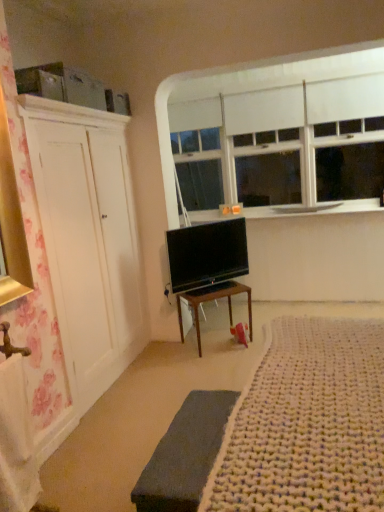
Locate an element on the screen. This screenshot has width=384, height=512. flat screen tv at center is located at coordinates (207, 254).

This screenshot has height=512, width=384. What do you see at coordinates (207, 254) in the screenshot? I see `flat screen tv at center` at bounding box center [207, 254].

At what (x,y) coordinates should I click in order to perform the action: click on white matte window at upper center. Please return your answer as a coordinate pair (x, y). Looking at the image, I should click on (283, 120).

The image size is (384, 512). Describe the element at coordinates (283, 120) in the screenshot. I see `white matte window at upper center` at that location.

This screenshot has width=384, height=512. I want to click on dark gray fabric bed frame at lower center, so click(x=185, y=454).

From a real-world perspective, which object rests below the other?

In real-world perspective, dark gray fabric bed frame at lower center is lower.

Is point (190, 429) farther from viewer compared to point (178, 295)?

No, it is not.

Which object is thinner, dark gray fabric bed frame at lower center or wooden desk at center?

With smaller width is dark gray fabric bed frame at lower center.

Is dark gray fabric bed frame at lower center taller or shorter than wooden desk at center?

Clearly, dark gray fabric bed frame at lower center is shorter compared to wooden desk at center.

Locate an element on the screen. Image resolution: width=384 pixels, height=512 pixels. plain on the right of dark gray fabric bed frame at lower center is located at coordinates (306, 423).

Which is closer, (139, 495) or (366, 485)?

Point (139, 495) appears to be farther away from the viewer than point (366, 485).

Considering the sizes of objects dark gray fabric bed frame at lower center and white knitted rug at lower right in the image provided, who is wider, dark gray fabric bed frame at lower center or white knitted rug at lower right?

With larger width is white knitted rug at lower right.

Does point (166, 175) lie behind point (336, 504)?

Yes, point (166, 175) is farther from viewer.

In the scene shown: Based on their positions, is white matte window at upper center located to the left or right of white knitted rug at lower right?

white matte window at upper center is to the right of white knitted rug at lower right.

Is there a large distance between white matte window at upper center and white knitted rug at lower right?

Yes, white matte window at upper center and white knitted rug at lower right are quite far apart.

Can you confirm if white matte window at upper center is bigger than white knitted rug at lower right?

Correct, white matte window at upper center is larger in size than white knitted rug at lower right.

Relative to white smooth window sill at upper center, is flat screen tv at center in front or behind?

In the image, flat screen tv at center appears in front of white smooth window sill at upper center.

From the image's perspective, which one is positioned lower, flat screen tv at center or white smooth window sill at upper center?

From the image's view, flat screen tv at center is below.

What's the angular difference between flat screen tv at center and white smooth window sill at upper center's facing directions?

There is a 47-degree angle between the facing directions of flat screen tv at center and white smooth window sill at upper center.

Considering the positions of point (178, 248) and point (321, 206), is point (178, 248) closer or farther from the camera than point (321, 206)?

Clearly, point (178, 248) is closer to the camera than point (321, 206).

Is flat screen tv at center surrounded by white matte window at upper center?

No, flat screen tv at center is not inside white matte window at upper center.

How far apart are white matte window at upper center and flat screen tv at center?

They are 4.08 feet apart.

What are the coordinates of `window that appears behind the flat screen tv at center` in the screenshot? It's located at (283, 120).

Based on their positions, is white matte window at upper center located to the left or right of flat screen tv at center?

white matte window at upper center is to the right of flat screen tv at center.

Which of these two, flat screen tv at center or white matte window at upper center, is smaller?

flat screen tv at center is smaller.

From a real-world perspective, is flat screen tv at center on white matte window at upper center?

Actually, flat screen tv at center is physically below white matte window at upper center in the real world.

Does flat screen tv at center come behind white matte window at upper center?

No, it is in front of white matte window at upper center.

I want to click on bed frame that is in front of the white matte window at upper center, so click(x=185, y=454).

Can you confirm if dark gray fabric bed frame at lower center is bigger than white matte window at upper center?

No, dark gray fabric bed frame at lower center is not bigger than white matte window at upper center.

From the image's perspective, which object appears higher, dark gray fabric bed frame at lower center or white matte window at upper center?

white matte window at upper center, from the image's perspective.

Which of these two, dark gray fabric bed frame at lower center or white matte window at upper center, is wider?

dark gray fabric bed frame at lower center is wider.

Locate an element on the screen. The image size is (384, 512). bed frame directly beneath the wooden desk at center (from a real-world perspective) is located at coordinates click(x=185, y=454).

Locate an element on the screen. Image resolution: width=384 pixels, height=512 pixels. bed frame behind the white knitted rug at lower right is located at coordinates (185, 454).

Estimate the real-world distances between objects in this image. Which object is closer to white smooth window sill at upper center, wooden desk at center or white matte window at upper center?

white matte window at upper center.

From the image, which object appears to be nearer to flat screen tv at center, white smooth window sill at upper center or white matte window at upper center?

white smooth window sill at upper center lies closer to flat screen tv at center than the other object.

Which object lies further to the anchor point white knitted rug at lower right, white matte window at upper center or dark gray fabric bed frame at lower center?

white matte window at upper center is positioned further to the anchor white knitted rug at lower right.

In the scene shown: Estimate the real-world distances between objects in this image. Which object is closer to wooden desk at center, white knitted rug at lower right or white smooth window sill at upper center?

The object closer to wooden desk at center is white smooth window sill at upper center.

From the image, which object appears to be farther from white smooth window sill at upper center, white matte window at upper center or white knitted rug at lower right?

The object further to white smooth window sill at upper center is white knitted rug at lower right.

When comparing their distances from white matte window at upper center, does dark gray fabric bed frame at lower center or white smooth window sill at upper center seem further?

dark gray fabric bed frame at lower center is positioned further to the anchor white matte window at upper center.

Looking at the image, which one is located further to white smooth window sill at upper center, flat screen tv at center or wooden desk at center?

The object further to white smooth window sill at upper center is wooden desk at center.

Looking at the image, which one is located further to dark gray fabric bed frame at lower center, wooden desk at center or flat screen tv at center?

flat screen tv at center is positioned further to the anchor dark gray fabric bed frame at lower center.

Locate an element on the screen. The width and height of the screenshot is (384, 512). television between white matte window at upper center and wooden desk at center in the vertical direction is located at coordinates (207, 254).

This screenshot has height=512, width=384. Find the location of `bed frame between white knitted rug at lower right and wooden desk at center from front to back`. bed frame between white knitted rug at lower right and wooden desk at center from front to back is located at coordinates (185, 454).

The width and height of the screenshot is (384, 512). Identify the location of desk between white knitted rug at lower right and white matte window at upper center along the z-axis. (212, 300).

The image size is (384, 512). Find the location of `bed frame between white knitted rug at lower right and white smooth window sill at upper center along the z-axis`. bed frame between white knitted rug at lower right and white smooth window sill at upper center along the z-axis is located at coordinates (185, 454).